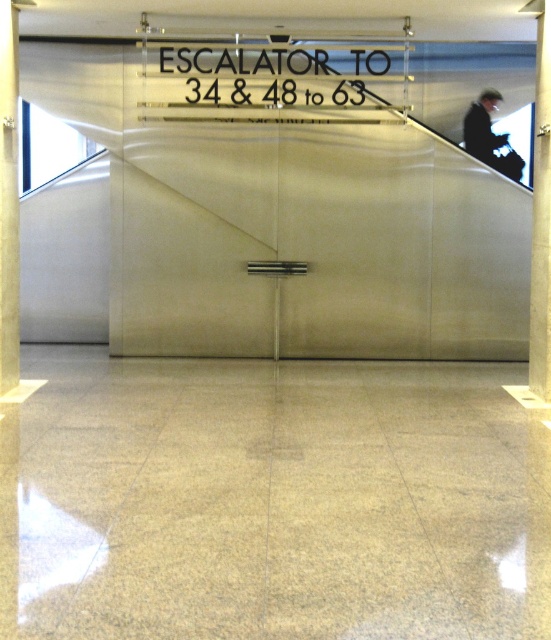
Between point (537, 220) and point (512, 150), which one is positioned in front?

Point (537, 220)

Is metallic pillar at right thinner than dark suit at upper right?

Yes.

Find the location of a particular element. metallic pillar at right is located at coordinates (541, 216).

Between yellow polished pillar at left and dark suit at upper right, which one is positioned higher?

dark suit at upper right is higher up.

Is yellow polished pillar at left bigger than dark suit at upper right?

Correct, yellow polished pillar at left is larger in size than dark suit at upper right.

Is point (17, 380) closer to camera compared to point (499, 170)?

Yes, it is in front of point (499, 170).

Locate an element on the screen. This screenshot has height=640, width=551. yellow polished pillar at left is located at coordinates 8,198.

Who is lower down, yellow polished pillar at left or metallic pillar at right?

metallic pillar at right is below.

Is yellow polished pillar at left smaller than metallic pillar at right?

Yes.

Looking at this image, who is more forward, (x=7, y=211) or (x=543, y=188)?

Point (x=7, y=211) is more forward.

Locate an element on the screen. Image resolution: width=551 pixels, height=640 pixels. yellow polished pillar at left is located at coordinates (8, 198).